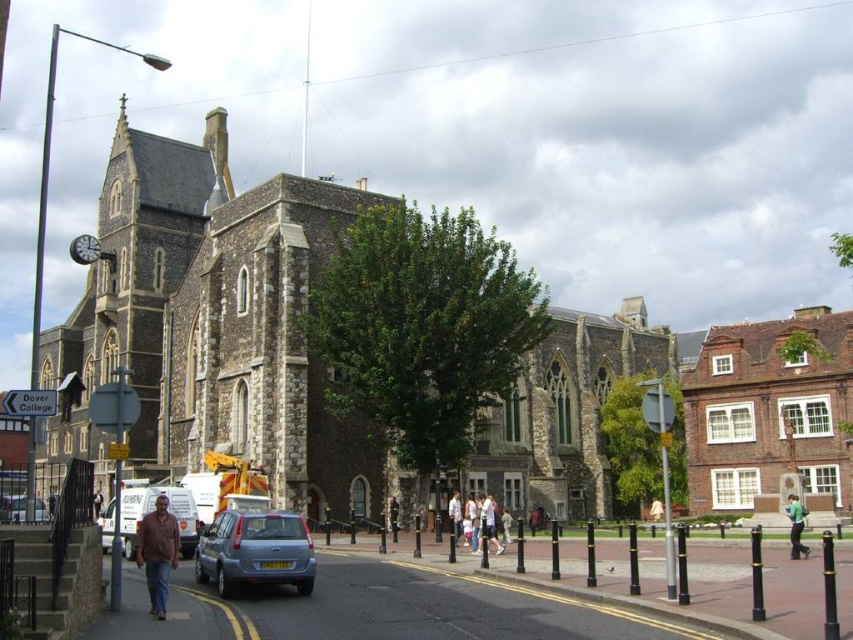
Which is below, metallic silver car at lower left or light brown leather jacket at center?

light brown leather jacket at center is lower down.

Does metallic silver car at lower left have a greater height compared to light brown leather jacket at center?

Correct, metallic silver car at lower left is much taller as light brown leather jacket at center.

Does point (0, 509) lie behind point (503, 544)?

Yes, point (0, 509) is farther from viewer.

You are a GUI agent. You are given a task and a screenshot of the screen. Output one action in this format:
    pyautogui.click(x=<x>, y=<y>)
    Task: Click on the metallic silver car at lower left
    
    Given the screenshot: What is the action you would take?
    pyautogui.click(x=12, y=508)

Which is above, brown brick building at center or matte blue car at lower center?

brown brick building at center is higher up.

Based on the photo, can you confirm if brown brick building at center is shorter than matte blue car at lower center?

In fact, brown brick building at center may be taller than matte blue car at lower center.

What do you see at coordinates (770, 412) in the screenshot? This screenshot has height=640, width=853. I see `brown brick building at center` at bounding box center [770, 412].

In order to click on brown brick building at center in this screenshot , I will do `click(770, 412)`.

Is point (227, 573) closer to camera compared to point (457, 518)?

Yes, it is in front of point (457, 518).

Does matte blue car at lower center have a greater height compared to white cotton shirt at center?

Indeed, matte blue car at lower center has a greater height compared to white cotton shirt at center.

Image resolution: width=853 pixels, height=640 pixels. What do you see at coordinates (254, 552) in the screenshot? I see `matte blue car at lower center` at bounding box center [254, 552].

Locate an element on the screen. The height and width of the screenshot is (640, 853). matte blue car at lower center is located at coordinates (254, 552).